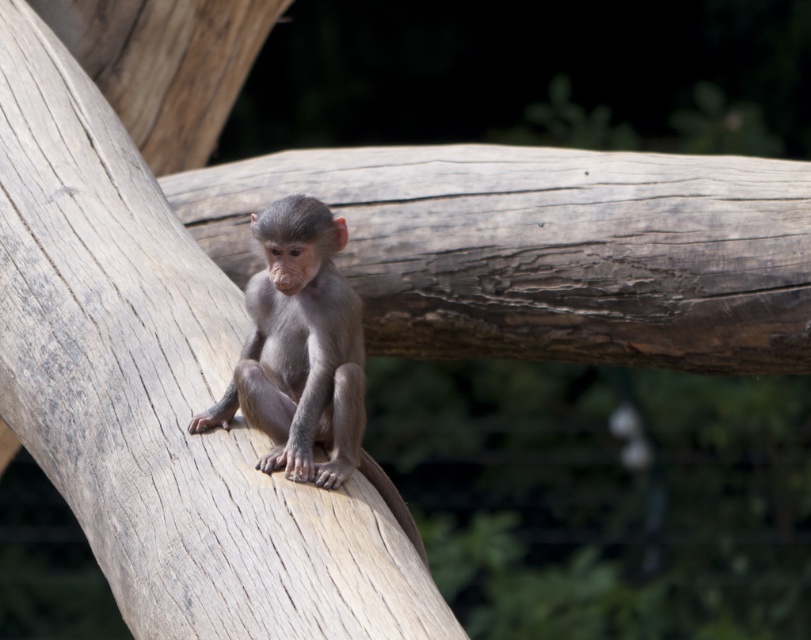
Does gray textured log at center have a lesser height compared to gray furry monkey at center?

Incorrect, gray textured log at center's height does not fall short of gray furry monkey at center's.

The height and width of the screenshot is (640, 811). In order to click on gray textured log at center in this screenshot , I will do `click(161, 392)`.

Between point (165, 310) and point (318, 416), which one is positioned in front?

Point (318, 416) is in front.

Locate an element on the screen. gray textured log at center is located at coordinates (161, 392).